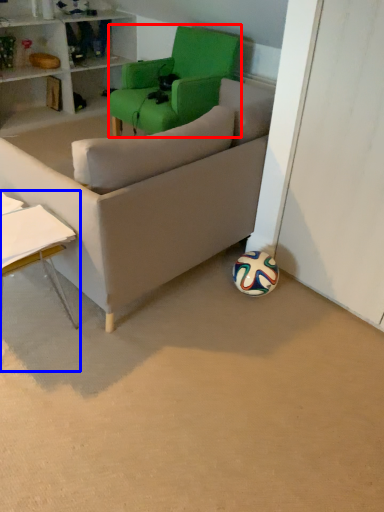
Question: Which point is further to the camera, chair (highlighted by a red box) or table (highlighted by a blue box)?

Choices:
 (A) chair
 (B) table

Answer: (A)